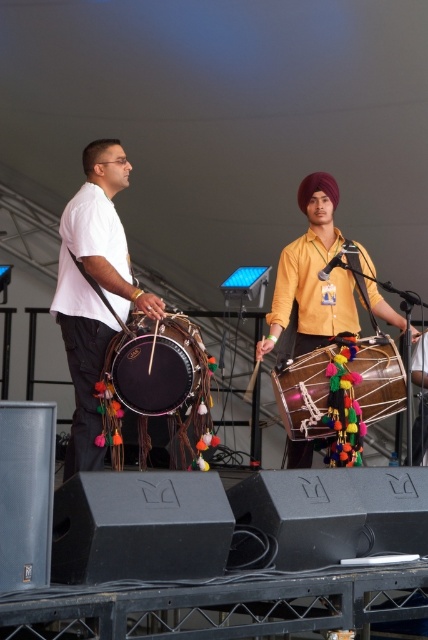
In the scene shown: You are a photographer trying to capture the performers under the tent. You notice the matte yellow shirt at center and the multicolored fabric drum at center. Which object should you focus on if you want to photograph the larger one?

The matte yellow shirt at center has a larger size compared to the multicolored fabric drum at center, so you should focus on the matte yellow shirt at center.

You are a stagehand setting up a new microphone stand. You need to place it exactly 0.1 units to the right and 0.05 units above the matte black drum at left. What are the coordinates where you should place the microphone stand?

The coordinates for the microphone stand would be calculated by adding 0.1 to the x and 0.05 to the y of the matte black drum at left. The original coordinates are at point (92, 291). Adding 0.1 to x gives 0.555, and adding 0.05 to y gives 0.267. Therefore, the microphone stand should be placed at coordinates (114, 355).